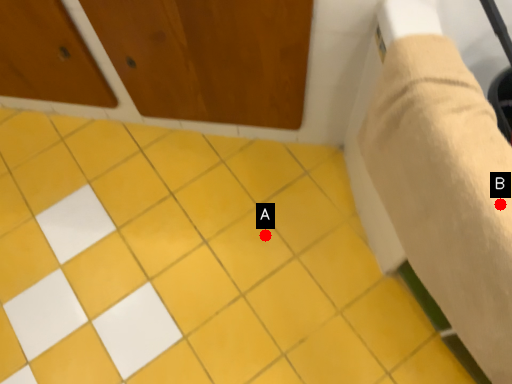
Question: Two points are circled on the image, labeled by A and B beside each circle. Which point is closer to the camera?

Choices:
 (A) A is closer
 (B) B is closer

Answer: (B)